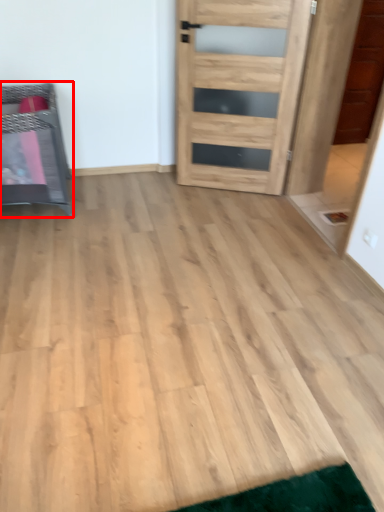
Question: From the image's perspective, where is furniture (annotated by the red box) located in relation to door in the image?

Choices:
 (A) above
 (B) below

Answer: (B)